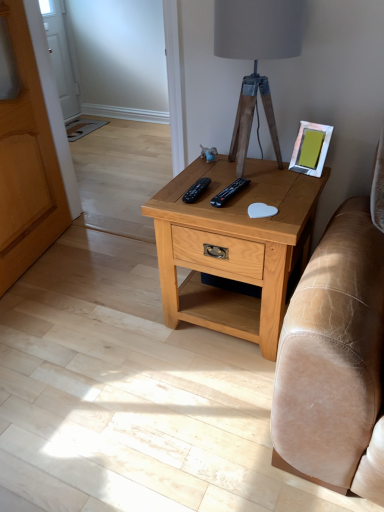
This screenshot has height=512, width=384. I want to click on vacant space positioned to the left of light brown wood nightstand at center, so click(x=123, y=321).